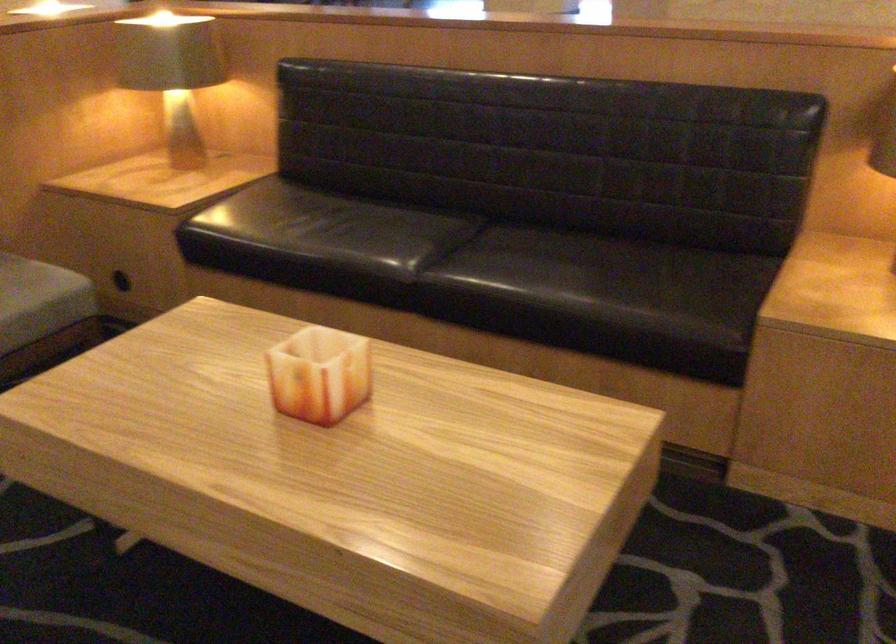
Describe the element at coordinates (319, 375) in the screenshot. The image size is (896, 644). I see `the orange square container` at that location.